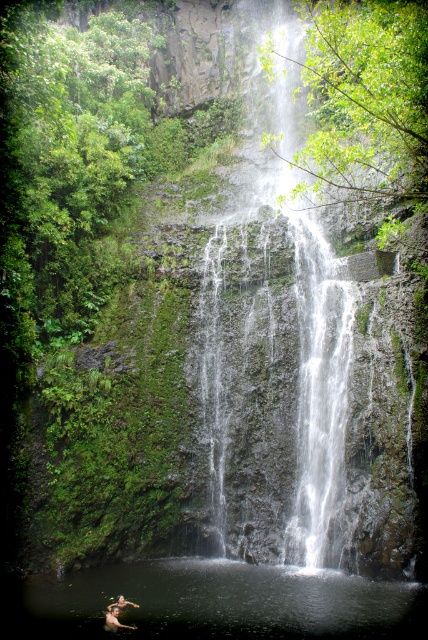
You are a photographer planning to take a photo of the clear water at center and the smooth skin person at lower left. Based on their positions, which object should you focus on first if you want to capture both in a single frame without moving the camera?

The smooth skin person at lower left should be focused on first because the clear water at center is positioned to the right of them, meaning they are closer to the left edge of the frame. By starting focus on the smooth skin person at lower left, you can ensure both subjects are within the camera frame without needing to reposition.

Consider the image. You are a photographer planning to take a photo of the waterfall scene. You want to ensure both the skinny person at lower center and the smooth skin person at lower left are visible in the frame. Given their heights, which person might appear smaller in the photo?

The skinny person at lower center is not as tall as the smooth skin person at lower left, so they would appear smaller in the photo.